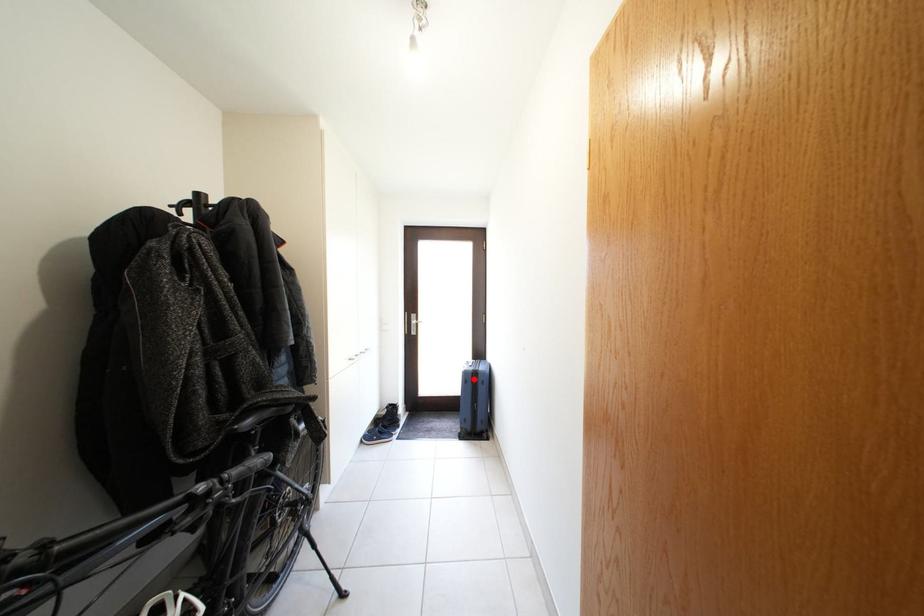
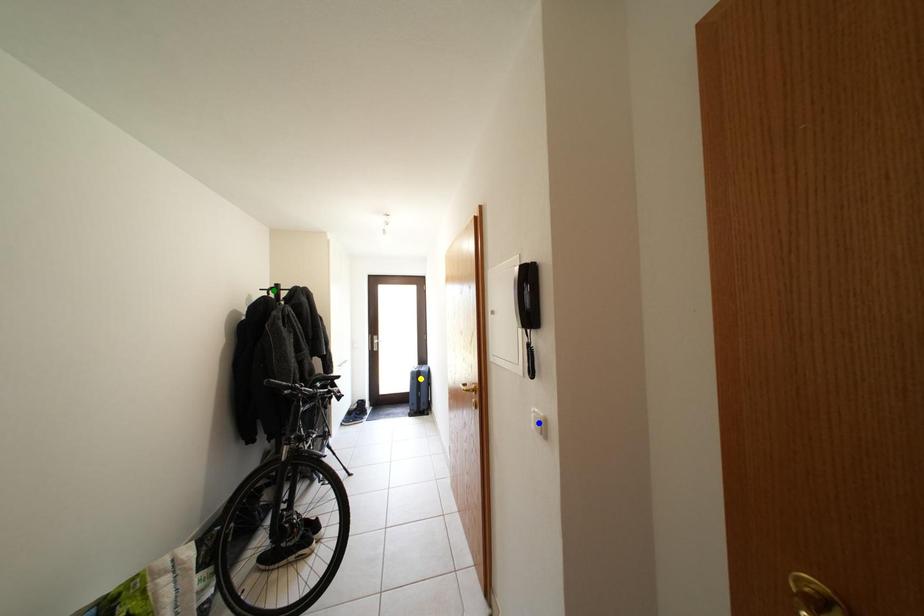
Question: I am providing you with two images of the same scene from different viewpoints. A red point is marked on the first image. You are given multiple points on the second image. Which point in image 2 is actually the same real-world point as the red point in image 1?

Choices:
 (A) yellow point
 (B) blue point
 (C) green point

Answer: (A)